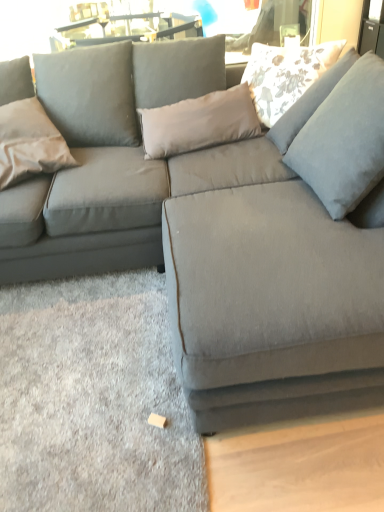
Question: Should I look upward or downward to see floral fabric pillow at upper right, the first pillow when ordered from right to left?

Choices:
 (A) down
 (B) up

Answer: (B)

Question: Does floral fabric pillow at upper right, the first pillow when ordered from right to left, have a lesser height compared to satin beige pillow at left, the first pillow in the left-to-right sequence?

Choices:
 (A) no
 (B) yes

Answer: (B)

Question: Is floral fabric pillow at upper right, the 2th pillow ordered from the bottom, taller than satin beige pillow at left, acting as the first pillow starting from the bottom?

Choices:
 (A) yes
 (B) no

Answer: (B)

Question: Does floral fabric pillow at upper right, which is counted as the 1th pillow, starting from the top, appear on the right side of satin beige pillow at left, positioned as the second pillow in right-to-left order?

Choices:
 (A) no
 (B) yes

Answer: (B)

Question: From a real-world perspective, is floral fabric pillow at upper right, the second pillow positioned from the left, positioned over satin beige pillow at left, positioned as the second pillow in right-to-left order, based on gravity?

Choices:
 (A) no
 (B) yes

Answer: (B)

Question: Does floral fabric pillow at upper right, the first pillow when ordered from right to left, appear on the left side of satin beige pillow at left, acting as the first pillow starting from the bottom?

Choices:
 (A) no
 (B) yes

Answer: (A)

Question: Could you tell me if floral fabric pillow at upper right, which is counted as the 1th pillow, starting from the top, is turned towards satin beige pillow at left, acting as the first pillow starting from the bottom?

Choices:
 (A) no
 (B) yes

Answer: (A)

Question: Is satin beige pillow at left, the first pillow in the left-to-right sequence, to the right of floral fabric pillow at upper right, the first pillow when ordered from right to left, from the viewer's perspective?

Choices:
 (A) yes
 (B) no

Answer: (B)

Question: Considering the relative sizes of satin beige pillow at left, the 2th pillow from the top, and floral fabric pillow at upper right, which is counted as the 1th pillow, starting from the top, in the image provided, is satin beige pillow at left, the 2th pillow from the top, wider than floral fabric pillow at upper right, which is counted as the 1th pillow, starting from the top,?

Choices:
 (A) yes
 (B) no

Answer: (B)

Question: From a real-world perspective, does satin beige pillow at left, the first pillow in the left-to-right sequence, stand above floral fabric pillow at upper right, the first pillow when ordered from right to left?

Choices:
 (A) yes
 (B) no

Answer: (B)

Question: Is satin beige pillow at left, acting as the first pillow starting from the bottom, located outside floral fabric pillow at upper right, the 2th pillow ordered from the bottom?

Choices:
 (A) yes
 (B) no

Answer: (A)

Question: Could you tell me if satin beige pillow at left, positioned as the second pillow in right-to-left order, is turned towards floral fabric pillow at upper right, the 2th pillow ordered from the bottom?

Choices:
 (A) no
 (B) yes

Answer: (A)

Question: Does satin beige pillow at left, positioned as the second pillow in right-to-left order, have a greater height compared to floral fabric pillow at upper right, the 2th pillow ordered from the bottom?

Choices:
 (A) yes
 (B) no

Answer: (A)

Question: From their relative heights in the image, would you say satin beige pillow at left, the 2th pillow from the top, is taller or shorter than floral fabric pillow at upper right, which is counted as the 1th pillow, starting from the top?

Choices:
 (A) tall
 (B) short

Answer: (A)